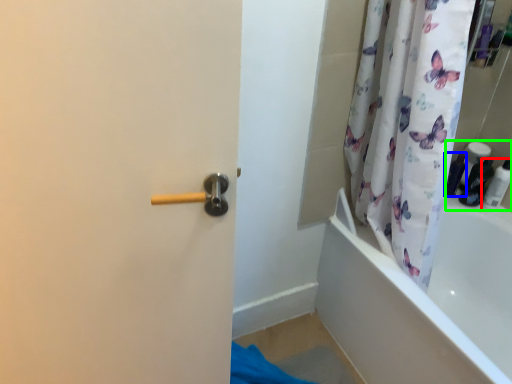
Question: Estimate the real-world distances between objects in this image. Which object is closer to toiletry (highlighted by a red box), toiletry (highlighted by a blue box) or toiletry (highlighted by a green box)?

Choices:
 (A) toiletry
 (B) toiletry

Answer: (B)